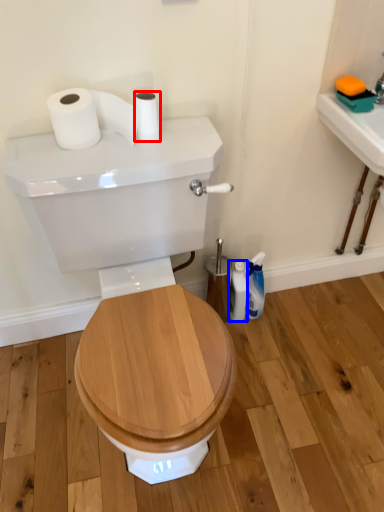
Question: Which point is further to the camera, toilet paper (highlighted by a red box) or toiletry (highlighted by a blue box)?

Choices:
 (A) toilet paper
 (B) toiletry

Answer: (B)